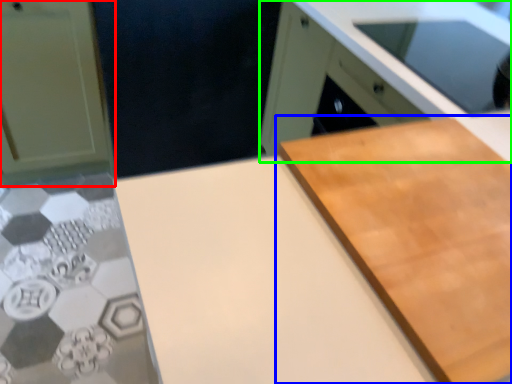
Question: Which object is the farthest from cabinetry (highlighted by a red box)? Choose among these: cutting board (highlighted by a blue box) or cabinetry (highlighted by a green box).

Choices:
 (A) cutting board
 (B) cabinetry

Answer: (A)